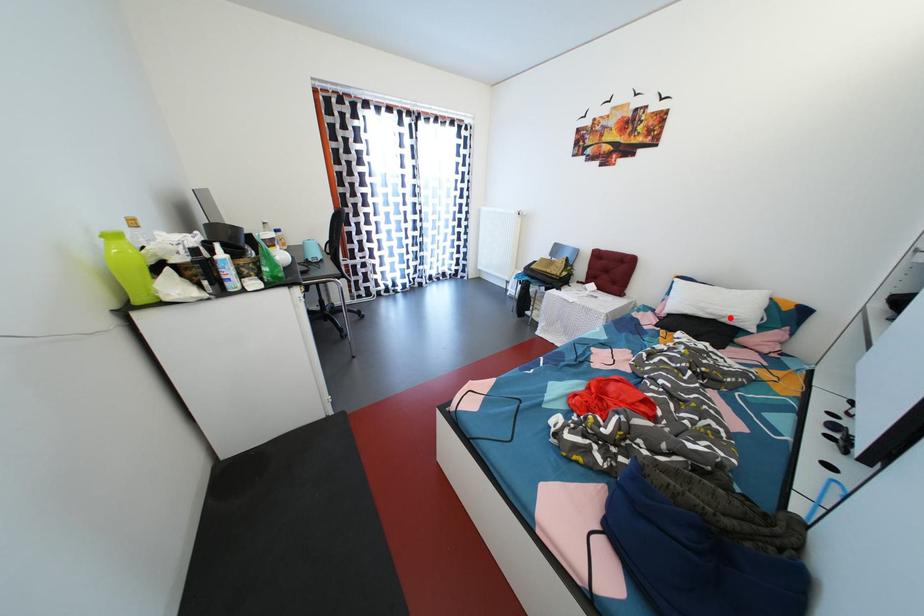
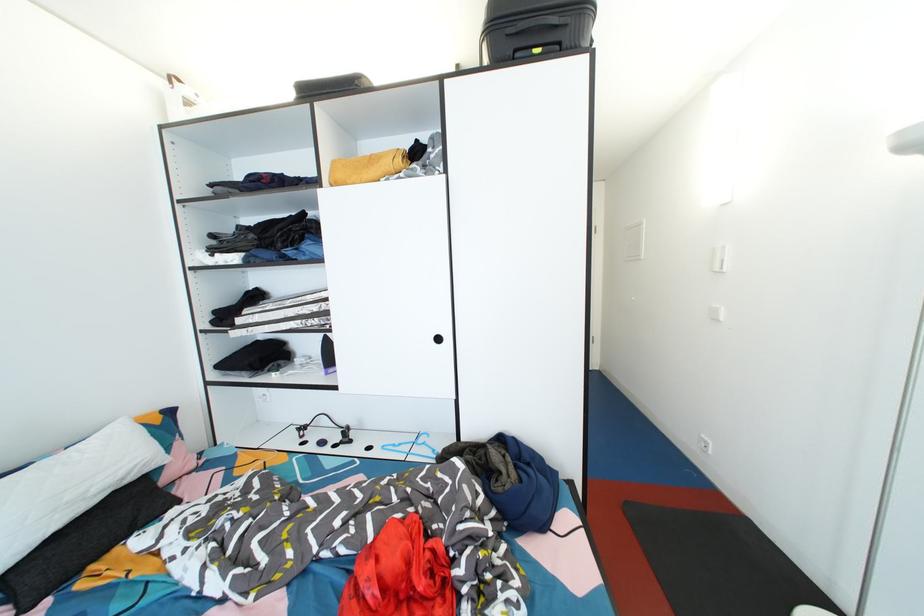
Locate, in the second image, the point that corresponds to the highlighted location in the first image.

(128, 477)